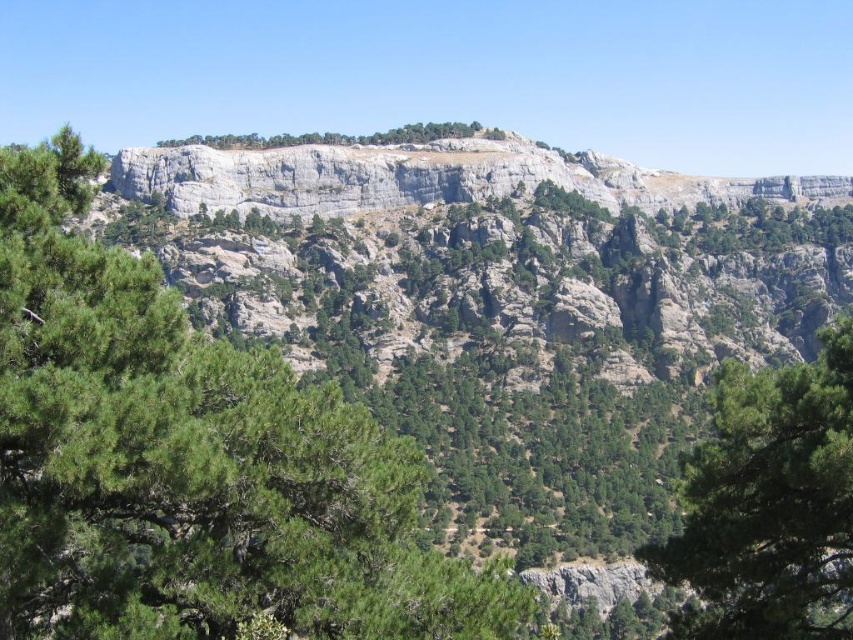
You are a hiker standing at the base of the mountain looking towards the cliffs. You see a green leafy tree at center and a green textured tree at right. Which tree is closer to your left side?

The green leafy tree at center is to the left of green textured tree at right, so it is closer to your left side.

You are standing in the mountainous landscape and want to take a photo of the green textured tree at right and the green leafy trees at center. Which tree is located to the right of the other?

The green textured tree at right is positioned on the right side of green leafy trees at center.